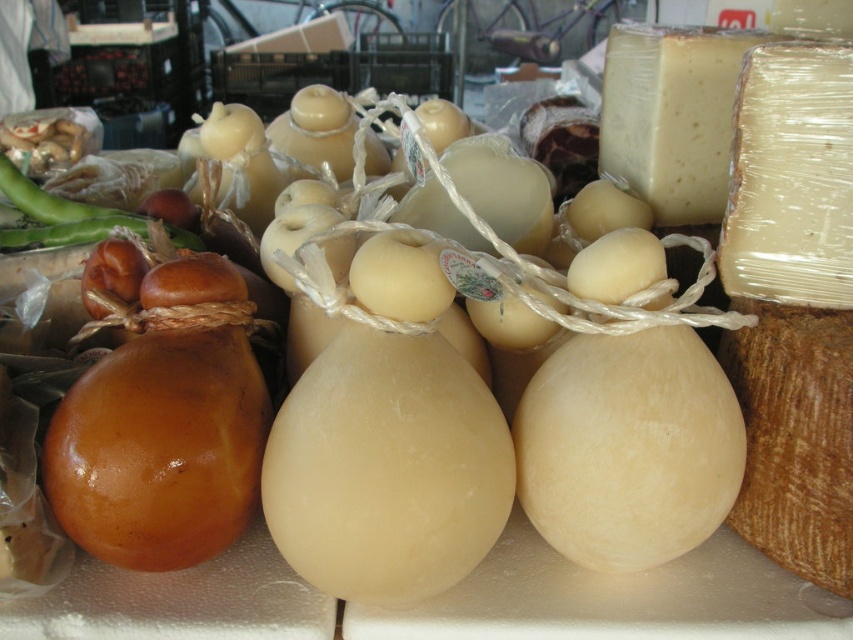
Between white wrapped block of cheese at upper right and translucent white cheese at upper right, which one is positioned lower?

white wrapped block of cheese at upper right

Is white wrapped block of cheese at upper right above translucent white cheese at upper right?

Actually, white wrapped block of cheese at upper right is below translucent white cheese at upper right.

Does point (804, 131) come farther from viewer compared to point (724, 122)?

No, (804, 131) is closer to viewer.

Where is `white wrapped block of cheese at upper right`? The width and height of the screenshot is (853, 640). white wrapped block of cheese at upper right is located at coordinates (791, 177).